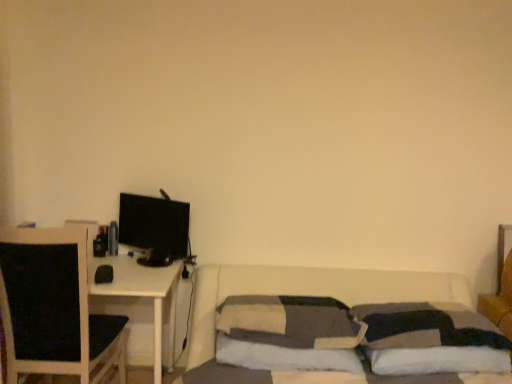
Question: From the image's perspective, is black glossy monitor at left beneath white soft pillow at lower right, the third pillow when ordered from left to right?

Choices:
 (A) yes
 (B) no

Answer: (B)

Question: Is black glossy monitor at left shorter than white soft pillow at lower right, the third pillow when ordered from left to right?

Choices:
 (A) no
 (B) yes

Answer: (A)

Question: From a real-world perspective, is black glossy monitor at left located higher than white soft pillow at lower right, acting as the 1th pillow starting from the right?

Choices:
 (A) yes
 (B) no

Answer: (A)

Question: From a real-world perspective, is black glossy monitor at left physically below white soft pillow at lower right, the third pillow when ordered from left to right?

Choices:
 (A) yes
 (B) no

Answer: (B)

Question: Is black glossy monitor at left turned away from white soft pillow at lower right, the third pillow when ordered from left to right?

Choices:
 (A) no
 (B) yes

Answer: (A)

Question: Does black glossy monitor at left appear on the right side of white soft pillow at lower right, the third pillow when ordered from left to right?

Choices:
 (A) yes
 (B) no

Answer: (B)

Question: From the image's perspective, would you say soft gray fabric pillow at center, positioned as the second pillow in right-to-left order, is positioned over black glossy monitor at left?

Choices:
 (A) yes
 (B) no

Answer: (B)

Question: Does soft gray fabric pillow at center, positioned as the second pillow in left-to-right order, have a lesser height compared to black glossy monitor at left?

Choices:
 (A) no
 (B) yes

Answer: (B)

Question: From a real-world perspective, is soft gray fabric pillow at center, positioned as the second pillow in left-to-right order, physically below black glossy monitor at left?

Choices:
 (A) yes
 (B) no

Answer: (A)

Question: Is soft gray fabric pillow at center, positioned as the second pillow in right-to-left order, smaller than black glossy monitor at left?

Choices:
 (A) no
 (B) yes

Answer: (A)

Question: Can you confirm if soft gray fabric pillow at center, positioned as the second pillow in left-to-right order, is thinner than black glossy monitor at left?

Choices:
 (A) no
 (B) yes

Answer: (A)

Question: Considering the relative sizes of soft gray fabric pillow at center, positioned as the second pillow in right-to-left order, and black glossy monitor at left in the image provided, is soft gray fabric pillow at center, positioned as the second pillow in right-to-left order, taller than black glossy monitor at left?

Choices:
 (A) yes
 (B) no

Answer: (B)

Question: Is soft gray fabric pillow at center, positioned as the second pillow in left-to-right order, in contact with black fabric chair at left?

Choices:
 (A) yes
 (B) no

Answer: (B)